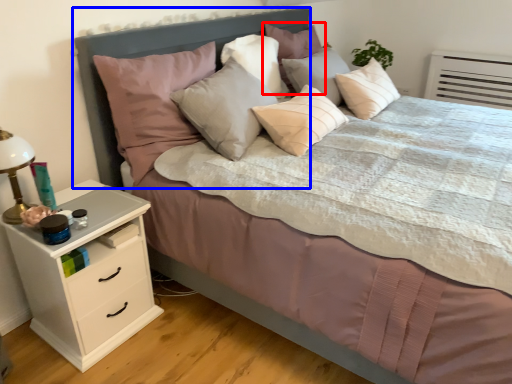
Question: Which point is further to the camera, pillow (highlighted by a red box) or headboard (highlighted by a blue box)?

Choices:
 (A) pillow
 (B) headboard

Answer: (A)